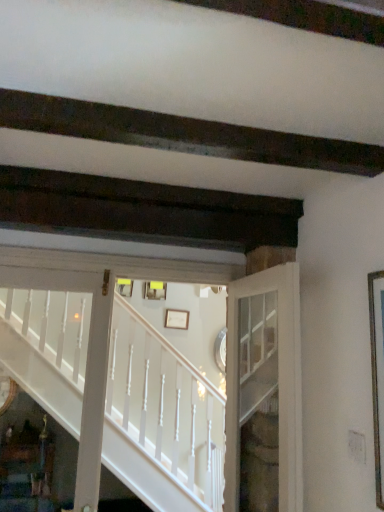
Question: Which is correct: white painted wood stairs at center is inside white matte picture frame at center, which is the 1th picture frame from bottom to top, or outside of it?

Choices:
 (A) inside
 (B) outside

Answer: (B)

Question: Relative to white matte picture frame at center, marked as the first picture frame in a right-to-left arrangement, is white painted wood stairs at center in front or behind?

Choices:
 (A) behind
 (B) front

Answer: (B)

Question: Which object is the farthest from the matte yellow picture frame at center, which is counted as the first picture frame, starting from the top?

Choices:
 (A) white glass door at center
 (B) white matte picture frame at center, which is the 1th picture frame from bottom to top
 (C) white painted wood stairs at center

Answer: (A)

Question: Which object is the farthest from the white painted wood stairs at center?

Choices:
 (A) white matte picture frame at center, which is the second picture frame in top-to-bottom order
 (B) matte yellow picture frame at center, placed as the 1th picture frame when sorted from left to right
 (C) white glass door at center

Answer: (A)